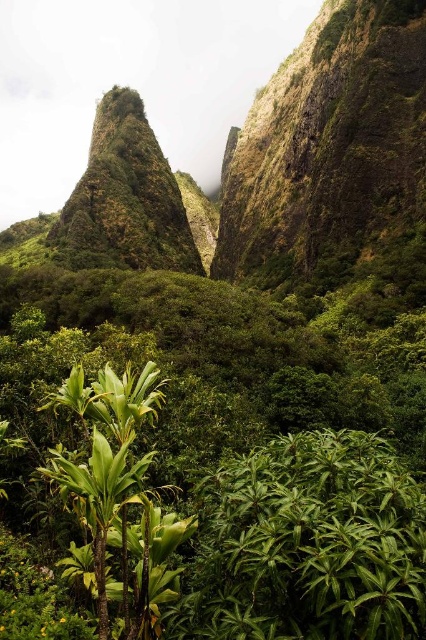
Question: Among these objects, which one is nearest to the camera?

Choices:
 (A) green mossy rock at center
 (B) green leafy plant at lower left

Answer: (B)

Question: Does green mossy rock at center have a greater width compared to green leafy plant at lower left?

Choices:
 (A) no
 (B) yes

Answer: (B)

Question: Does green mossy rock at center come behind green leafy plant at lower left?

Choices:
 (A) no
 (B) yes

Answer: (B)

Question: Which of the following is the farthest from the observer?

Choices:
 (A) green leafy plant at lower left
 (B) green mossy rock at upper center
 (C) green mossy rock at center

Answer: (C)

Question: Is green mossy rock at upper center bigger than green leafy plant at lower left?

Choices:
 (A) yes
 (B) no

Answer: (A)

Question: Which object is the closest to the green mossy rock at upper center?

Choices:
 (A) green mossy rock at center
 (B) green leafy plant at lower left

Answer: (A)